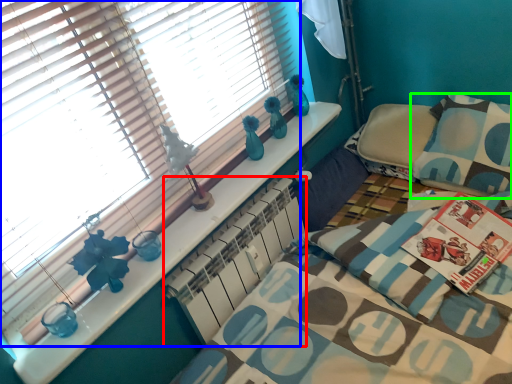
Question: Considering the real-world distances, which object is farthest from radiator (highlighted by a red box)? window blind (highlighted by a blue box) or pillow (highlighted by a green box)?

Choices:
 (A) window blind
 (B) pillow

Answer: (B)